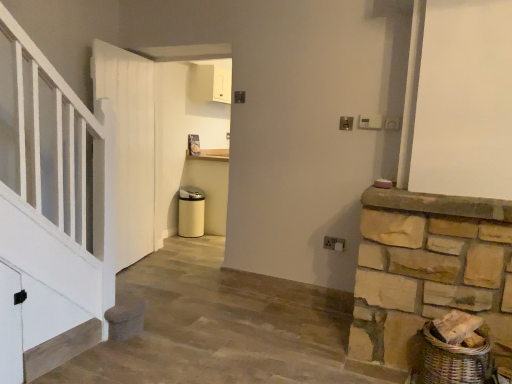
Question: Is natural stone mantle at right taller or shorter than white wooden door at left?

Choices:
 (A) short
 (B) tall

Answer: (A)

Question: Does point (467, 196) appear closer or farther from the camera than point (105, 94)?

Choices:
 (A) closer
 (B) farther

Answer: (A)

Question: Considering the positions of natural stone mantle at right and white wooden door at left in the image, is natural stone mantle at right wider or thinner than white wooden door at left?

Choices:
 (A) wide
 (B) thin

Answer: (A)

Question: Do you think white wooden door at left is within natural stone mantle at right, or outside of it?

Choices:
 (A) inside
 (B) outside

Answer: (B)

Question: Considering the positions of point (135, 170) and point (472, 208), is point (135, 170) closer or farther from the camera than point (472, 208)?

Choices:
 (A) closer
 (B) farther

Answer: (B)

Question: From the image's perspective, is white wooden door at left positioned above or below natural stone mantle at right?

Choices:
 (A) above
 (B) below

Answer: (A)

Question: In terms of size, does white wooden door at left appear bigger or smaller than natural stone mantle at right?

Choices:
 (A) small
 (B) big

Answer: (B)